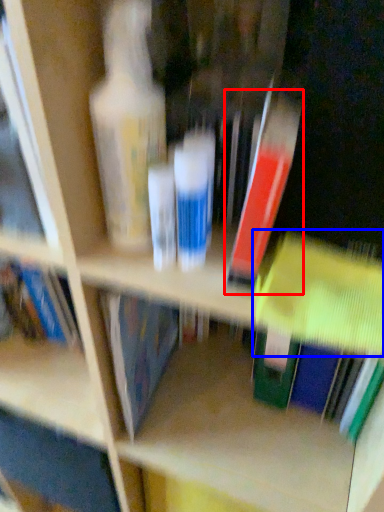
Question: Which point is further to the camera, book (highlighted by a red box) or book (highlighted by a blue box)?

Choices:
 (A) book
 (B) book

Answer: (B)